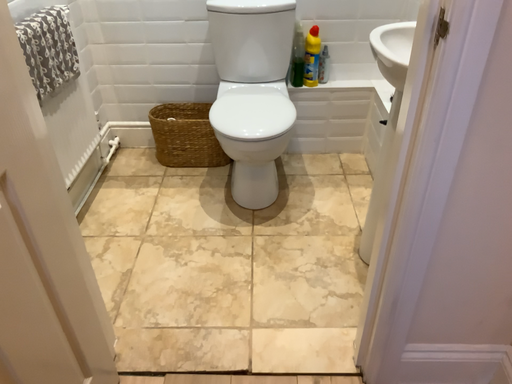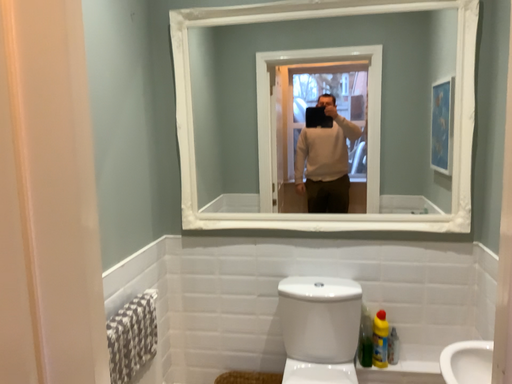
Question: How did the camera likely rotate when shooting the video?

Choices:
 (A) rotated downward
 (B) rotated upward

Answer: (B)